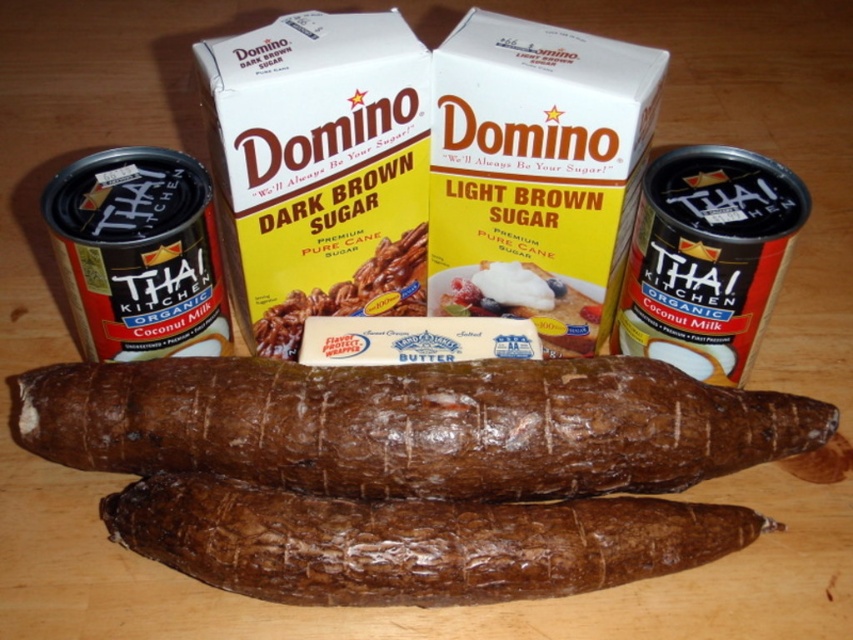
Question: Which point is closer to the camera?

Choices:
 (A) (590, 314)
 (B) (543, 422)

Answer: (B)

Question: Can you confirm if brown rough textured yam at center is wider than dark brown sugar at center?

Choices:
 (A) no
 (B) yes

Answer: (B)

Question: Does brown rough textured yam at center have a larger size compared to brown rough textured yams at bottom?

Choices:
 (A) yes
 (B) no

Answer: (A)

Question: Can you confirm if dark brown sugar at center is thinner than buttery smooth butter at center?

Choices:
 (A) yes
 (B) no

Answer: (B)

Question: Which point is closer to the camera?

Choices:
 (A) (459, 307)
 (B) (314, 547)
 (C) (281, 461)

Answer: (B)

Question: Which is nearer to the brown rough textured yams at bottom?

Choices:
 (A) dark brown sugar at center
 (B) brown rough textured yam at center

Answer: (B)